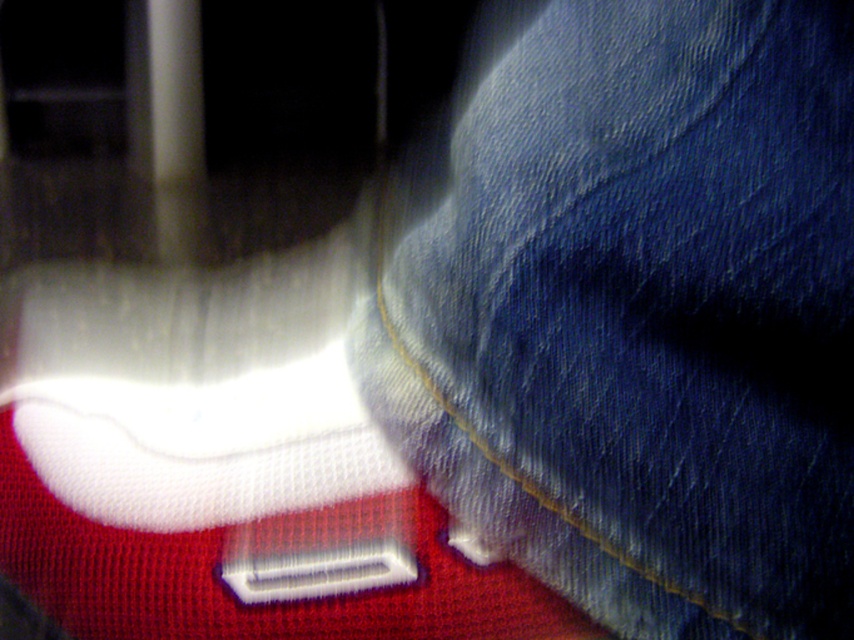
Between denim at center and white mesh sock at lower left, which one appears on the left side from the viewer's perspective?

white mesh sock at lower left

Is denim at center smaller than white mesh sock at lower left?

No.

Is point (502, 337) behind point (493, 598)?

No, (502, 337) is closer to viewer.

The image size is (854, 640). Find the location of `denim at center`. denim at center is located at coordinates (636, 310).